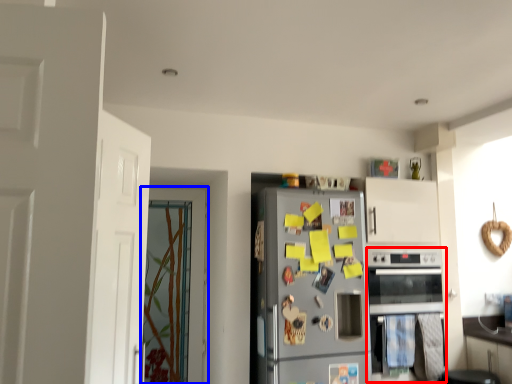
Question: Among these objects, which one is farthest to the camera, oven (highlighted by a red box) or door (highlighted by a blue box)?

Choices:
 (A) oven
 (B) door

Answer: (B)